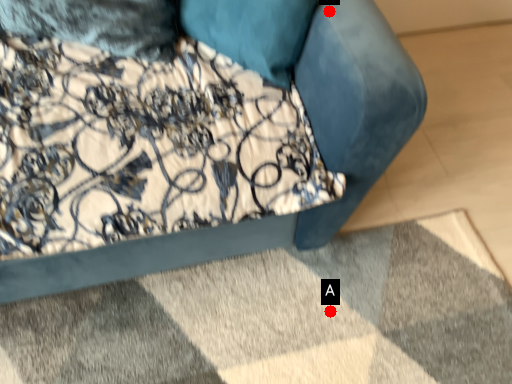
Question: Two points are circled on the image, labeled by A and B beside each circle. Among these points, which one is nearest to the camera?

Choices:
 (A) A is closer
 (B) B is closer

Answer: (B)